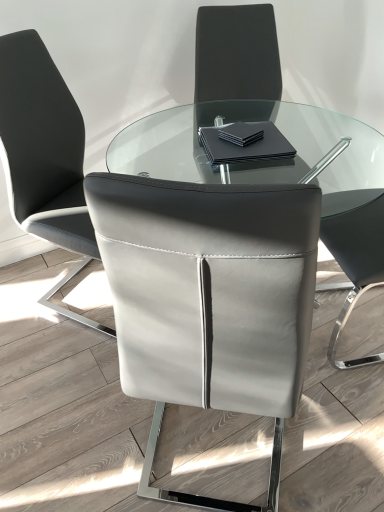
I want to click on vacant space situated on the left part of white leather chair at center, positioned as the first chair in left-to-right order, so click(26, 290).